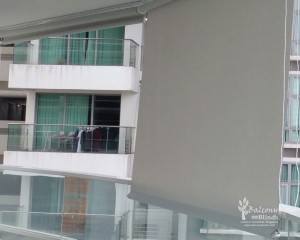
The width and height of the screenshot is (300, 240). Find the location of `tables`. tables is located at coordinates (63, 137).